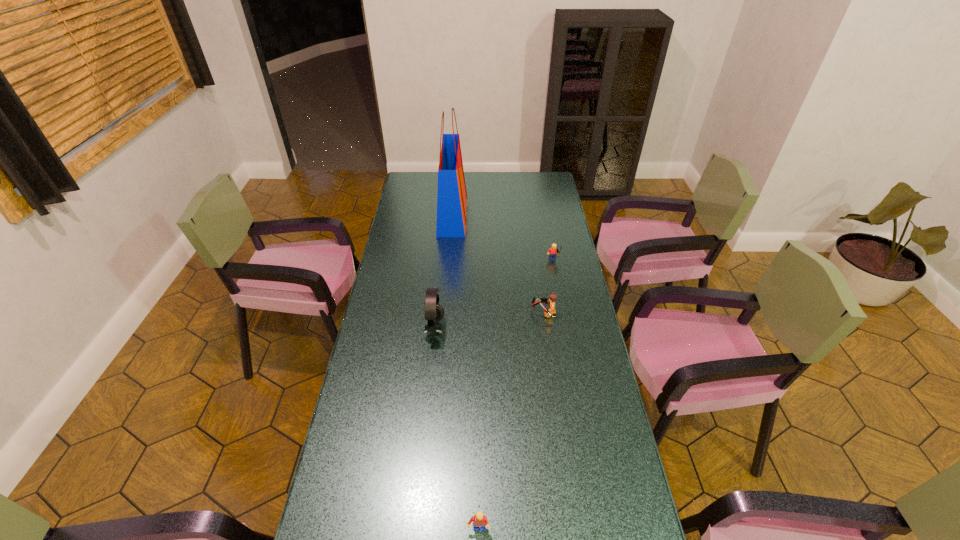
Where is `object identified as the third closest to the tallest object`? The image size is (960, 540). object identified as the third closest to the tallest object is located at coordinates (552, 297).

This screenshot has width=960, height=540. Find the location of `object that is the fourth closest to the earphone`. object that is the fourth closest to the earphone is located at coordinates (479, 519).

Find the location of a particular element. The width and height of the screenshot is (960, 540). the closest Lego relative to the nearest Lego is located at coordinates (552, 297).

Locate an element on the screen. Lego that is the second closest to the earphone is located at coordinates (553, 251).

Image resolution: width=960 pixels, height=540 pixels. In order to click on free space that satisfies the following two spatial constraints: 1. on the front-facing side of the rightmost Lego; 2. on the ear cups of the earphone in this screenshot , I will do point(566,329).

The width and height of the screenshot is (960, 540). I want to click on vacant space that satisfies the following two spatial constraints: 1. on the front-facing side of the second farthest object; 2. holding a crossbow in the hands of the second object from right to left, so click(563, 313).

Image resolution: width=960 pixels, height=540 pixels. I want to click on vacant region that satisfies the following two spatial constraints: 1. on the front-facing side of the fourth nearest object; 2. on the ear cups of the fourth shortest object, so click(566, 329).

Where is `vacant space that satisfies the following two spatial constraints: 1. holding a crossbow in the hands of the second farthest Lego; 2. on the front-facing side of the nearest object`? vacant space that satisfies the following two spatial constraints: 1. holding a crossbow in the hands of the second farthest Lego; 2. on the front-facing side of the nearest object is located at coordinates (575, 529).